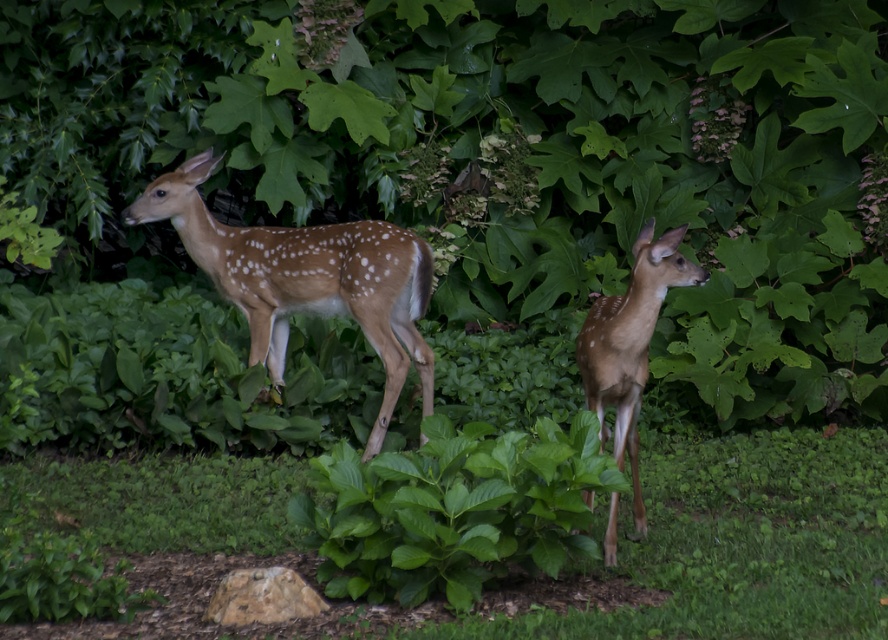
Does brown speckled fur at center have a greater width compared to brown matte/deer at center?

Yes.

Can you confirm if brown speckled fur at center is positioned to the left of brown matte/deer at center?

Correct, you'll find brown speckled fur at center to the left of brown matte/deer at center.

The height and width of the screenshot is (640, 888). I want to click on brown speckled fur at center, so click(306, 280).

Between point (823, 214) and point (659, 518), which one is positioned behind?

The point (823, 214) is more distant.

How much distance is there between green leafy tree at center and green leafy grass at center?

They are 7.61 meters apart.

Is point (680, 129) farther from viewer compared to point (706, 611)?

Yes, it is behind point (706, 611).

I want to click on green leafy tree at center, so click(x=498, y=154).

Does green leafy grass at center appear under brown matte/deer at center?

Correct, green leafy grass at center is located below brown matte/deer at center.

Does point (821, 528) lie behind point (628, 324)?

Yes, point (821, 528) is farther from viewer.

The width and height of the screenshot is (888, 640). Identify the location of green leafy grass at center. (744, 541).